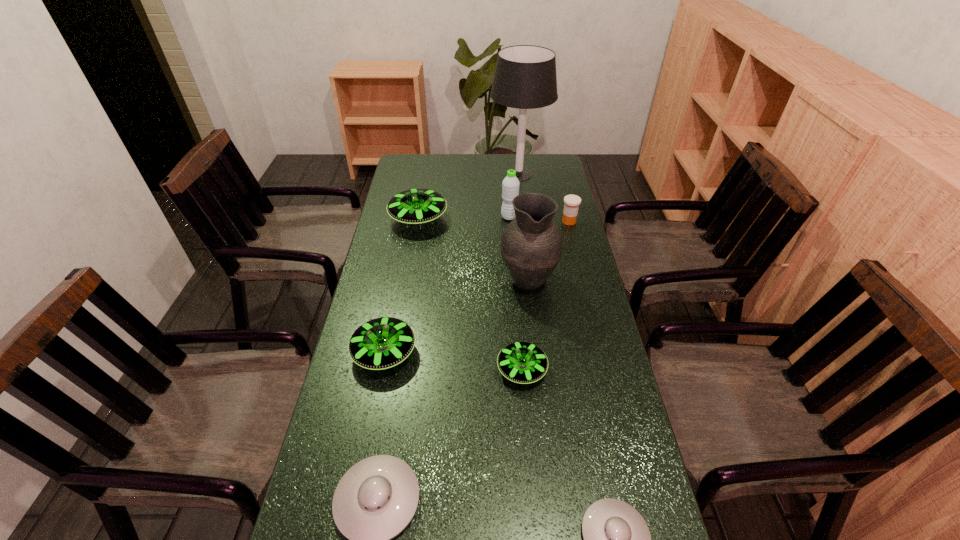
You are a GUI agent. You are given a task and a screenshot of the screen. Output one action in this format:
    pyautogui.click(x=<x>, y=<y>)
    Task: Click on the table lamp
    This screenshot has height=540, width=960.
    Given the screenshot: What is the action you would take?
    point(525,77)

Identify the location of the farthest object. This screenshot has width=960, height=540. (525, 77).

Identify the location of pitcher. (531, 245).

Identify the location of the fifth nearest object. This screenshot has width=960, height=540. (531, 245).

The height and width of the screenshot is (540, 960). Find the location of `green water bottle`. green water bottle is located at coordinates (510, 186).

You are a GUI agent. You are given a task and a screenshot of the screen. Output one action in this format:
    pyautogui.click(x=<x>, y=<y>)
    Task: Click on the third tallest object
    The image size is (960, 540).
    Given the screenshot: What is the action you would take?
    pyautogui.click(x=510, y=186)

Where is `the farthest green saucer`? the farthest green saucer is located at coordinates (415, 206).

The width and height of the screenshot is (960, 540). Identify the location of the tallest saucer. (415, 206).

The height and width of the screenshot is (540, 960). What are the coordinates of `orange medicine` in the screenshot? It's located at (571, 202).

At what (x,y) coordinates should I click in order to perform the action: click on the second biggest green saucer. Please return your answer as a coordinate pair (x, y). The image size is (960, 540). Looking at the image, I should click on (381, 343).